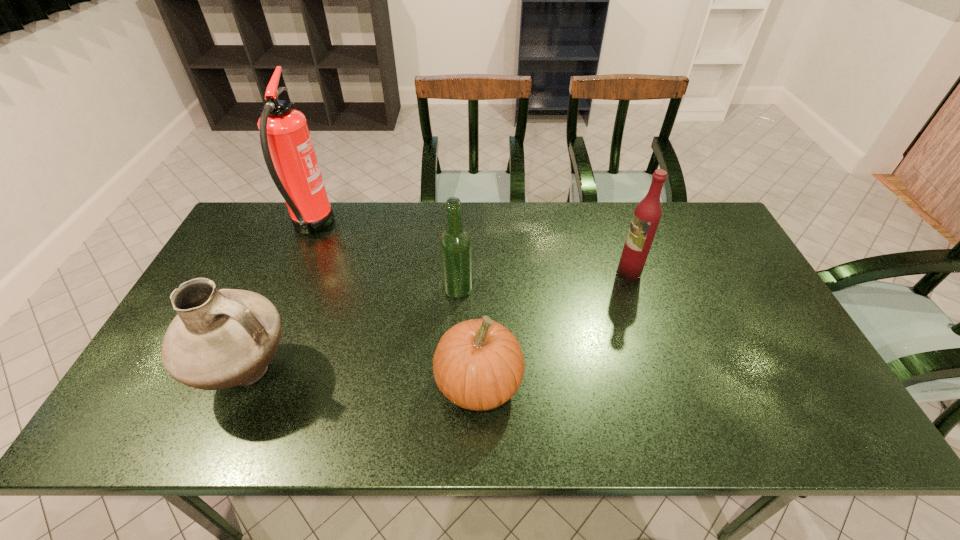
Locate an element on the screen. free space located 0.210m on the left of the left liquor is located at coordinates (370, 289).

In order to click on free region located 0.210m on the handle side of the pitcher in this screenshot , I will do point(384,375).

At what (x,y) coordinates should I click in order to perform the action: click on vacant region located 0.370m on the stem of the pumpkin. Please return your answer as a coordinate pair (x, y). Image resolution: width=960 pixels, height=540 pixels. Looking at the image, I should click on (678, 384).

The height and width of the screenshot is (540, 960). What are the coordinates of `object located at the far edge` in the screenshot? It's located at (288, 151).

I want to click on pitcher that is at the near edge, so click(x=222, y=338).

Where is `pumpkin at the near edge`? This screenshot has height=540, width=960. pumpkin at the near edge is located at coordinates (478, 364).

Identify the location of object that is at the left edge. This screenshot has width=960, height=540. click(x=222, y=338).

Locate an element on the screen. Image resolution: width=960 pixels, height=540 pixels. object at the near left corner is located at coordinates (222, 338).

In the image, there is a desktop. Find the location of `vacant space at the far edge`. vacant space at the far edge is located at coordinates (554, 212).

The width and height of the screenshot is (960, 540). I want to click on vacant space at the near edge, so click(x=525, y=437).